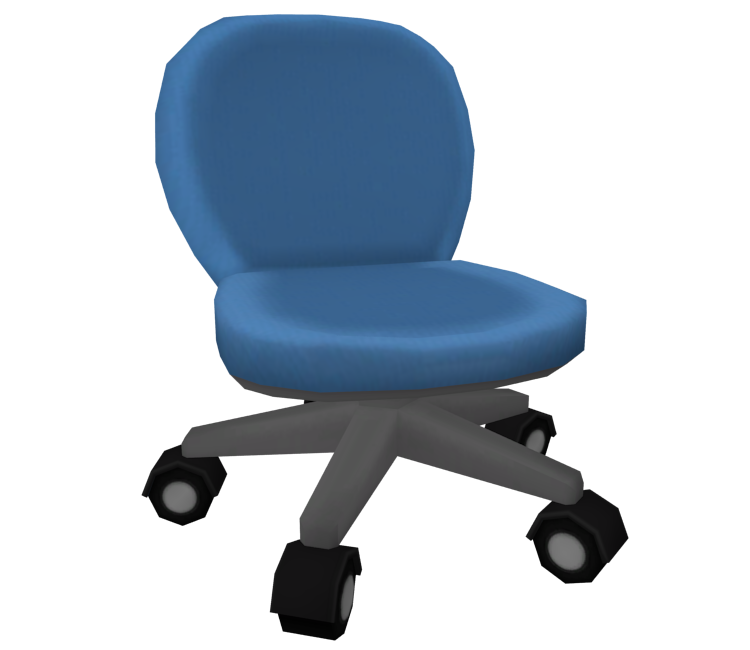
Image resolution: width=750 pixels, height=650 pixels. Identify the location of fabric creases around back of chair. (170, 205), (154, 161), (156, 114), (166, 66), (202, 27).